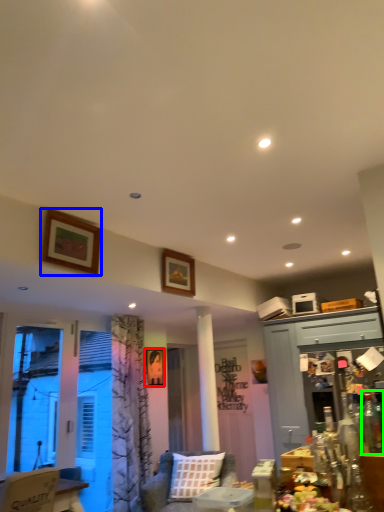
Question: Which object is the closest to the picture frame (highlighted by a red box)? Choose among these: picture frame (highlighted by a blue box) or bottle (highlighted by a green box).

Choices:
 (A) picture frame
 (B) bottle

Answer: (A)